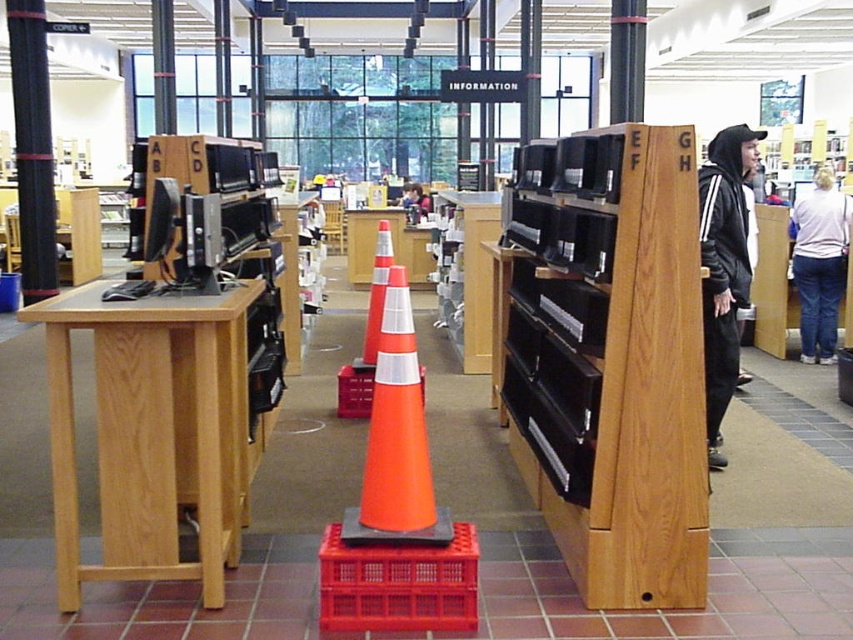
Question: Does matte orange cone at center lie in front of orange plastic traffic cone at center?

Choices:
 (A) yes
 (B) no

Answer: (A)

Question: Which object is the closest to the orange plastic traffic cone at center?

Choices:
 (A) orange matte traffic cone at center
 (B) black hoodie at right

Answer: (B)

Question: Which point appears closest to the camera in this image?

Choices:
 (A) (819, 282)
 (B) (376, 381)

Answer: (B)

Question: Which point appears closest to the camera in this image?

Choices:
 (A) (389, 522)
 (B) (22, 163)
 (C) (743, 250)

Answer: (A)

Question: Is the position of white cotton shirt at upper right less distant than that of orange plastic traffic cone at center?

Choices:
 (A) no
 (B) yes

Answer: (A)

Question: Is wooden bookshelf at center smaller than smooth skin face at center?

Choices:
 (A) yes
 (B) no

Answer: (B)